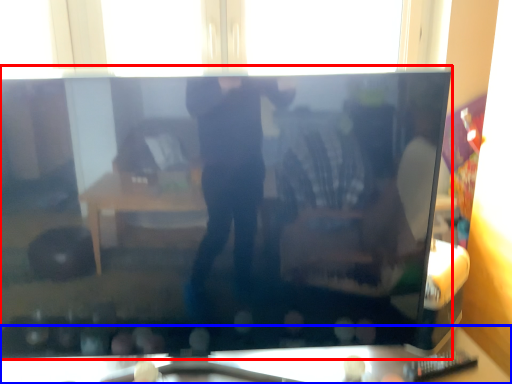
Question: Which object appears farthest to the camera in this image, television (highlighted by a red box) or furniture (highlighted by a blue box)?

Choices:
 (A) television
 (B) furniture

Answer: (B)